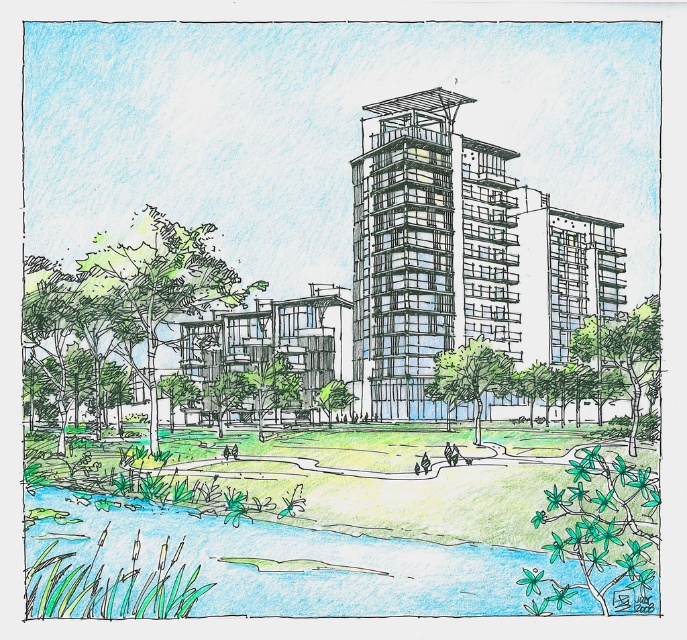
Looking at this image, you are an architect reviewing the design of the residential complex. You notice two structures labeled as the transparent glass building at center and the transparent glass tower at center. Which one do you think occupies more floor space in the design?

The transparent glass building at center has a larger size compared to the transparent glass tower at center, so it occupies more floor space in the design.